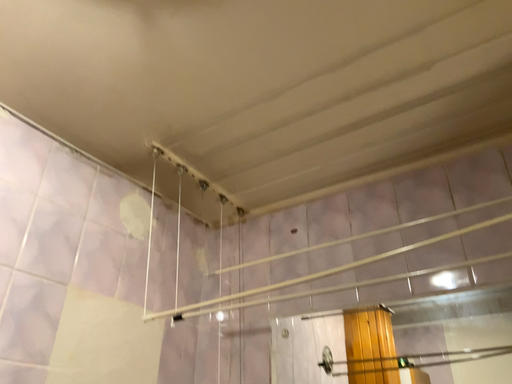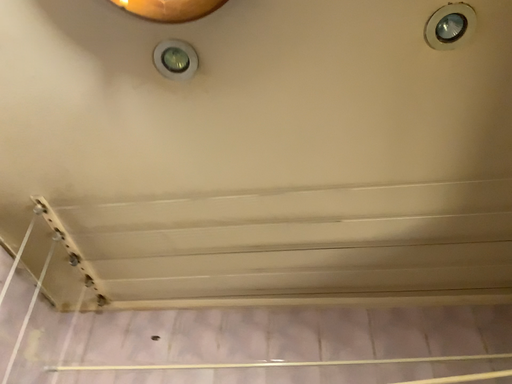
Question: How did the camera likely rotate when shooting the video?

Choices:
 (A) rotated downward
 (B) rotated upward

Answer: (B)